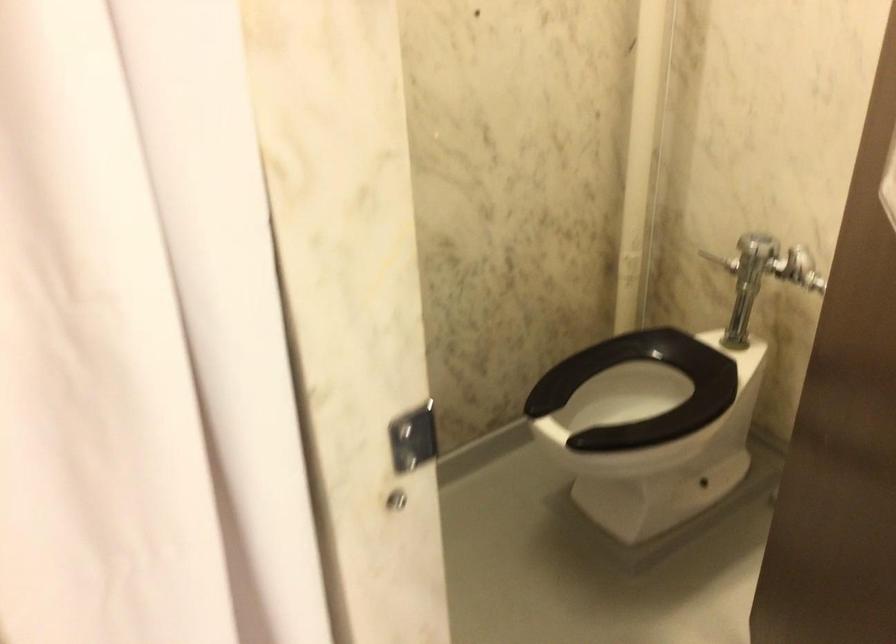
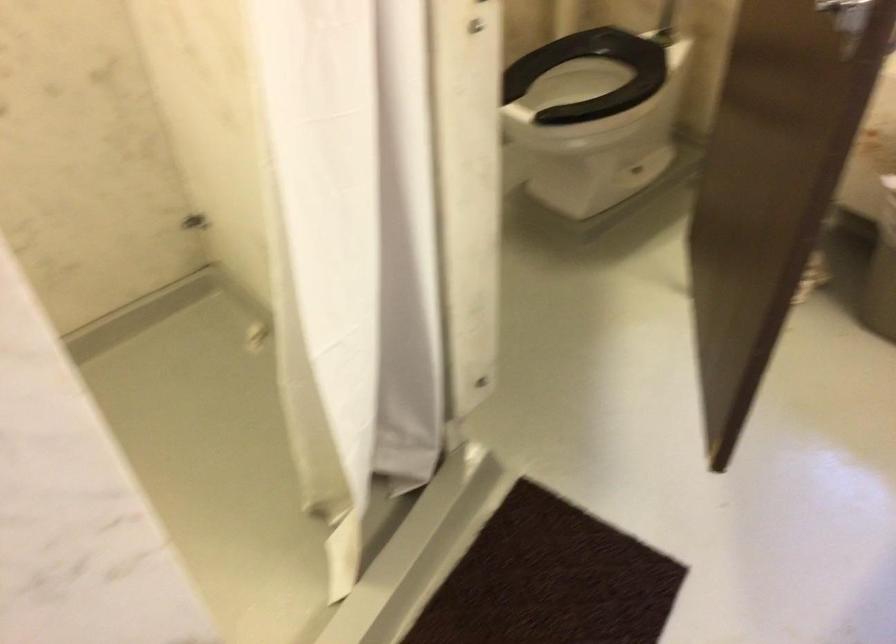
Find the pixel in the second image that matches (x=649, y=381) in the first image.

(591, 75)